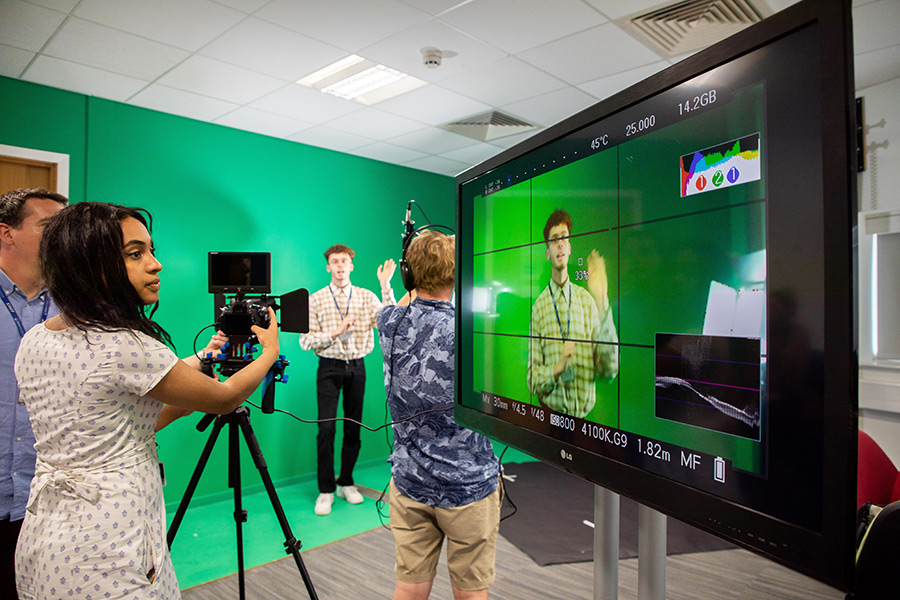
Image resolution: width=900 pixels, height=600 pixels. What are the coordinates of `door` in the screenshot? It's located at (20, 181).